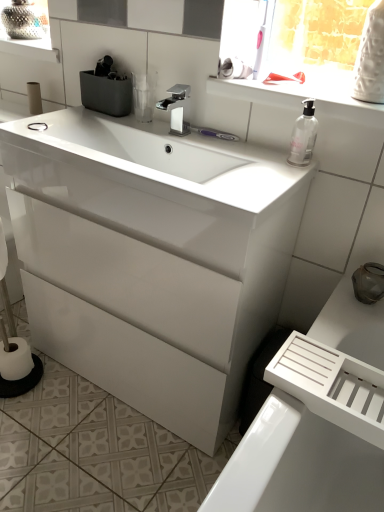
Find the location of a particular element. This screenshot has width=384, height=512. space that is in front of white matte toilet paper at upper center, which is the 3th toilet paper in left-to-right order is located at coordinates (255, 83).